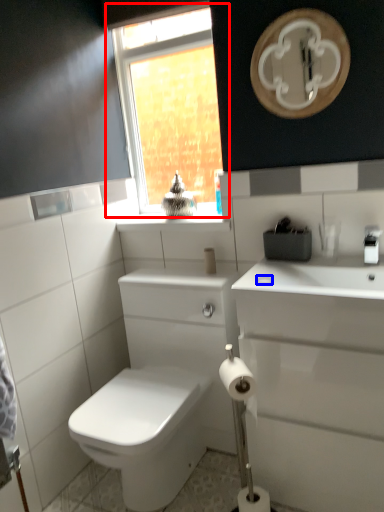
Question: Which point is closer to the camera, window (highlighted by a red box) or soap (highlighted by a blue box)?

Choices:
 (A) window
 (B) soap

Answer: (B)